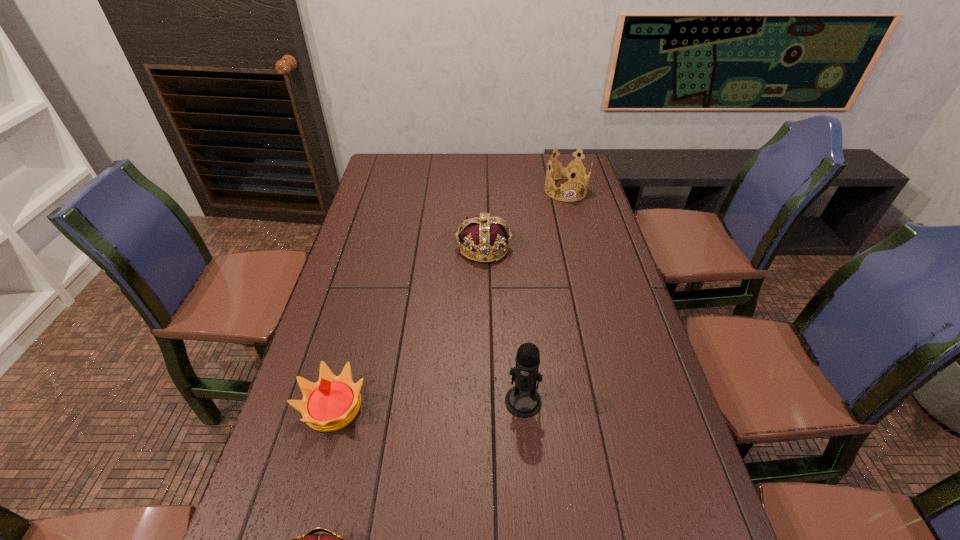
Locate an element on the screen. free spot located 0.170m on the back of the second nearest crown is located at coordinates (355, 326).

The image size is (960, 540). What are the coordinates of `object present at the far edge` in the screenshot? It's located at (568, 172).

The height and width of the screenshot is (540, 960). I want to click on object present at the left edge, so point(330,404).

This screenshot has width=960, height=540. In order to click on object that is at the right edge in this screenshot , I will do `click(568, 172)`.

Identify the location of object situated at the far right corner. This screenshot has width=960, height=540. (568, 172).

The width and height of the screenshot is (960, 540). In the image, there is a desktop. What are the coordinates of `free space at the far edge` in the screenshot? It's located at (484, 154).

Find the location of a particular element. The width and height of the screenshot is (960, 540). vacant space at the left edge of the desktop is located at coordinates (309, 521).

Where is `blank area at the right edge`? The width and height of the screenshot is (960, 540). blank area at the right edge is located at coordinates (617, 420).

Identify the location of blank space at the far left corner of the desktop. (409, 177).

The image size is (960, 540). Find the location of `free space between the rightmost object and the second crown from right to left`. free space between the rightmost object and the second crown from right to left is located at coordinates (525, 219).